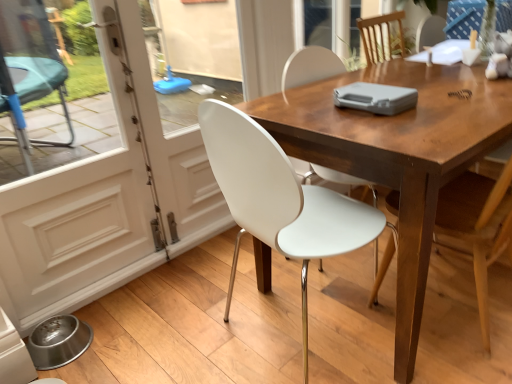
Question: From the image's perspective, is white plastic chair at center, marked as the second chair in a right-to-left arrangement, on top of wooden chair at center, the second chair from the left?

Choices:
 (A) yes
 (B) no

Answer: (B)

Question: From a real-world perspective, is white plastic chair at center, positioned as the first chair in left-to-right order, beneath wooden chair at center, the second chair from the left?

Choices:
 (A) no
 (B) yes

Answer: (B)

Question: From a real-world perspective, is white plastic chair at center, marked as the second chair in a right-to-left arrangement, located higher than wooden chair at center, the second chair from the left?

Choices:
 (A) yes
 (B) no

Answer: (B)

Question: Does white plastic chair at center, positioned as the first chair in left-to-right order, come behind wooden chair at center, the second chair from the left?

Choices:
 (A) yes
 (B) no

Answer: (B)

Question: Is wooden chair at center, the 1th chair from the right, at the back of white plastic chair at center, positioned as the first chair in left-to-right order?

Choices:
 (A) yes
 (B) no

Answer: (B)

Question: From the image's perspective, is white glossy screen door at left, which is the 2th screen door from left to right, positioned above or below wooden chair at center, the second chair from the left?

Choices:
 (A) below
 (B) above

Answer: (B)

Question: Which is correct: white glossy screen door at left, marked as the 1th screen door in a right-to-left arrangement, is inside wooden chair at center, the 1th chair from the right, or outside of it?

Choices:
 (A) inside
 (B) outside

Answer: (B)

Question: In terms of size, does white glossy screen door at left, marked as the 1th screen door in a right-to-left arrangement, appear bigger or smaller than wooden chair at center, the second chair from the left?

Choices:
 (A) big
 (B) small

Answer: (B)

Question: Is white glossy screen door at left, which is the 2th screen door from left to right, wider or thinner than wooden chair at center, the second chair from the left?

Choices:
 (A) thin
 (B) wide

Answer: (A)

Question: In the image, is white glossy screen door at left, which appears as the 2th screen door when viewed from the right, on the left side or the right side of white plastic chair at center, marked as the second chair in a right-to-left arrangement?

Choices:
 (A) right
 (B) left

Answer: (B)

Question: In the image, is white glossy screen door at left, positioned as the 1th screen door in left-to-right order, positioned in front of or behind white plastic chair at center, positioned as the first chair in left-to-right order?

Choices:
 (A) front
 (B) behind

Answer: (B)

Question: Is white glossy screen door at left, which appears as the 2th screen door when viewed from the right, inside or outside of white plastic chair at center, marked as the second chair in a right-to-left arrangement?

Choices:
 (A) outside
 (B) inside

Answer: (A)

Question: From a real-world perspective, relative to white plastic chair at center, marked as the second chair in a right-to-left arrangement, is white glossy screen door at left, positioned as the 1th screen door in left-to-right order, vertically above or below?

Choices:
 (A) below
 (B) above

Answer: (B)

Question: In the image, is wooden table at center positioned in front of or behind wooden chair at center, the second chair from the left?

Choices:
 (A) front
 (B) behind

Answer: (B)

Question: Considering the positions of wooden table at center and wooden chair at center, the 1th chair from the right, in the image, is wooden table at center taller or shorter than wooden chair at center, the 1th chair from the right,?

Choices:
 (A) short
 (B) tall

Answer: (A)